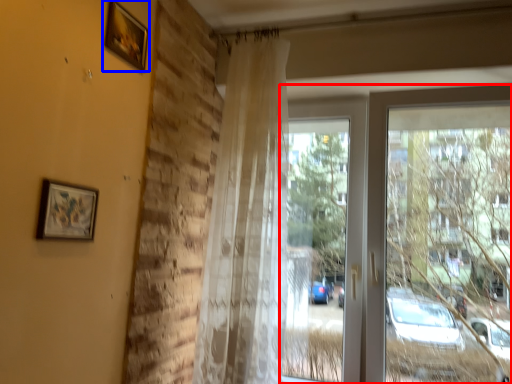
Question: Which of the following is the closest to the observer, window (highlighted by a red box) or picture frame (highlighted by a blue box)?

Choices:
 (A) window
 (B) picture frame

Answer: (B)